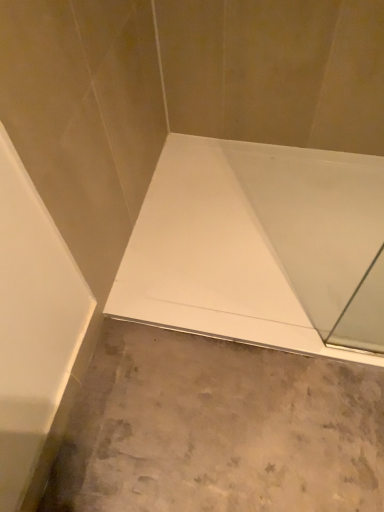
Identify the location of vacant area on top of white glossy bath at center (from a real-world perspective). pyautogui.click(x=220, y=246).